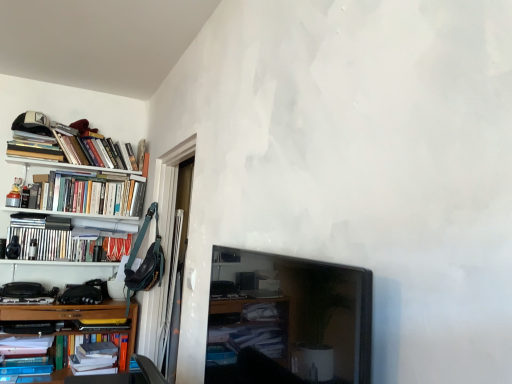
This screenshot has width=512, height=384. In order to click on empty space that is ontop of hardcover books at left, which appears as the fourth book when ordered from the bottom (from a real-world perspective) in this screenshot , I will do `click(69, 230)`.